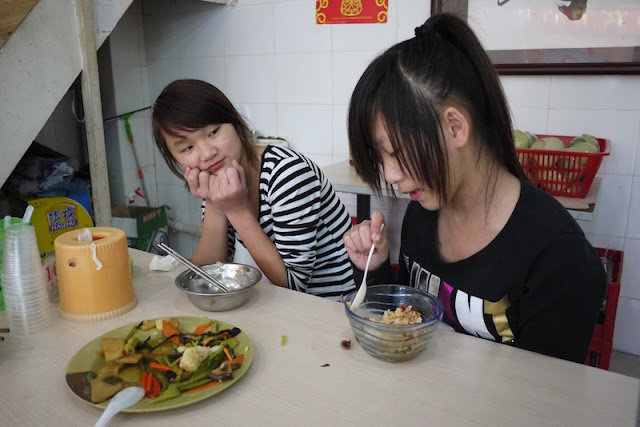
Find the location of a particular element. The height and width of the screenshot is (427, 640). red plastic basket is located at coordinates (556, 155).